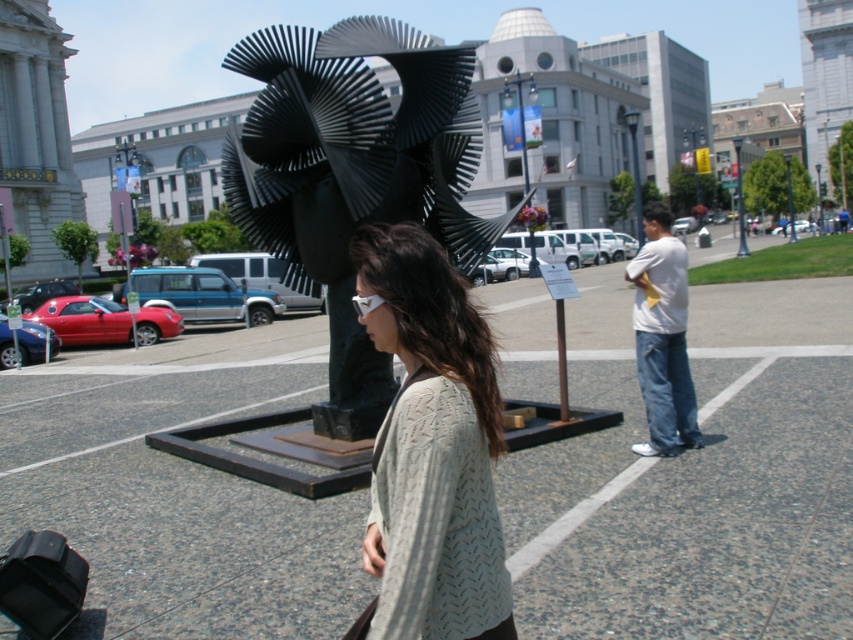
Question: Which object is farther from the camera taking this photo?

Choices:
 (A) metallic pole at upper center
 (B) metallic streetlight at upper center

Answer: (B)

Question: Does knitted gray sweater at center appear on the left side of metallic streetlight at upper center?

Choices:
 (A) no
 (B) yes

Answer: (B)

Question: Which point is closer to the camera?

Choices:
 (A) (399, 164)
 (B) (450, 540)
 (C) (791, 212)

Answer: (B)

Question: Does metallic streetlight at upper center come behind metallic pole at upper center?

Choices:
 (A) yes
 (B) no

Answer: (A)

Question: Is black metal sculpture at center to the left of metallic pole at upper right from the viewer's perspective?

Choices:
 (A) yes
 (B) no

Answer: (A)

Question: Which point appears farthest from the camera in this image?

Choices:
 (A) (657, 435)
 (B) (738, 157)

Answer: (B)